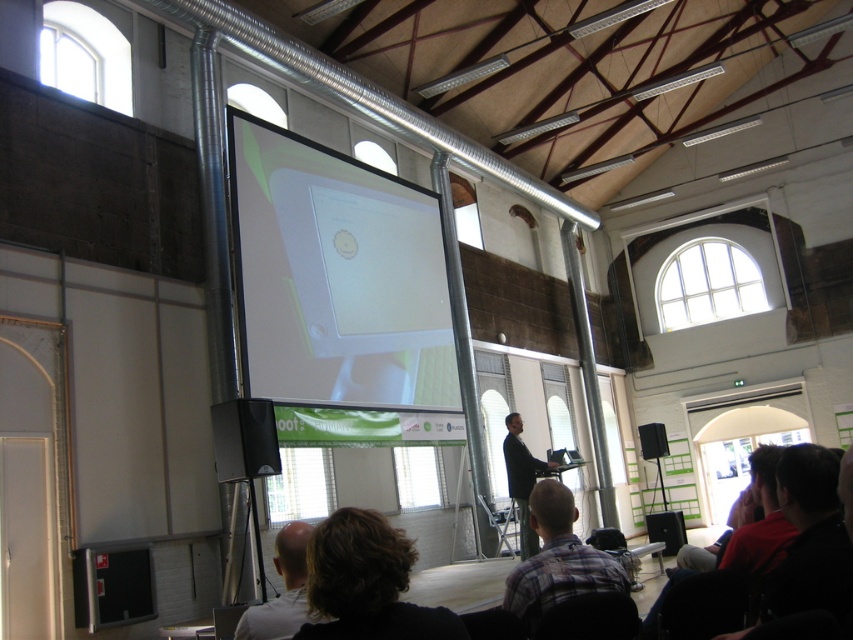
Between point (403, 616) and point (663, 424), which one is positioned in front?

Point (403, 616) is more forward.

Who is more distant from viewer, [378,522] or [640,440]?

The point [640,440] is behind.

Find the location of a particular element. brown hair at lower center is located at coordinates (367, 582).

Describe the element at coordinates (339, 292) in the screenshot. I see `white glossy projector screen at center` at that location.

Is white glossy projector screen at center further to the viewer compared to plaid fabric shirt at lower center?

Yes, it is.

The image size is (853, 640). Describe the element at coordinates (339, 292) in the screenshot. I see `white glossy projector screen at center` at that location.

Image resolution: width=853 pixels, height=640 pixels. In order to click on white glossy projector screen at center in this screenshot , I will do `click(339, 292)`.

Is black fabric speaker at lower right positioned behind black plastic speaker at lower right?

No, black fabric speaker at lower right is closer to the viewer.

Can you confirm if black fabric speaker at lower right is positioned to the left of black plastic speaker at lower right?

Yes, black fabric speaker at lower right is to the left of black plastic speaker at lower right.

Which is behind, point (664, 547) or point (653, 451)?

Positioned behind is point (653, 451).

Identify the location of black fabric speaker at lower right. (666, 529).